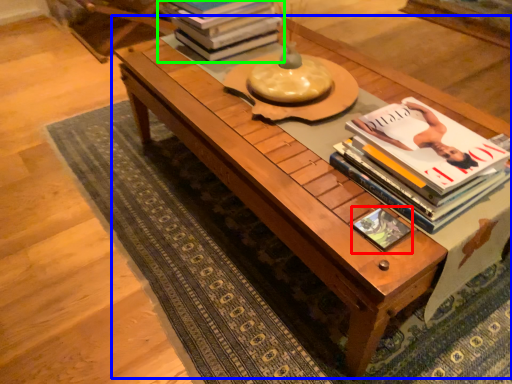
Question: Considering the real-world distances, which object is closest to book cover (highlighted by a red box)? table (highlighted by a blue box) or book (highlighted by a green box).

Choices:
 (A) table
 (B) book

Answer: (A)